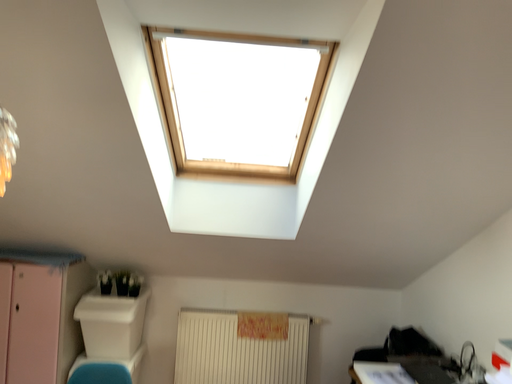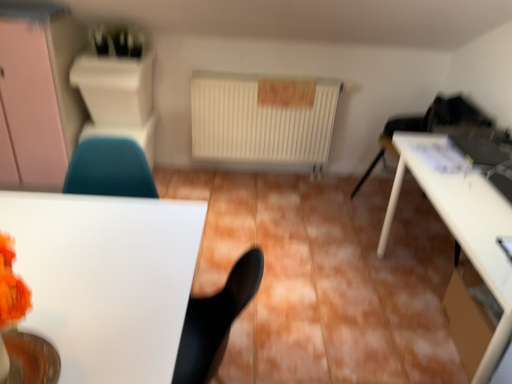
Question: How did the camera likely rotate when shooting the video?

Choices:
 (A) rotated downward
 (B) rotated upward

Answer: (A)